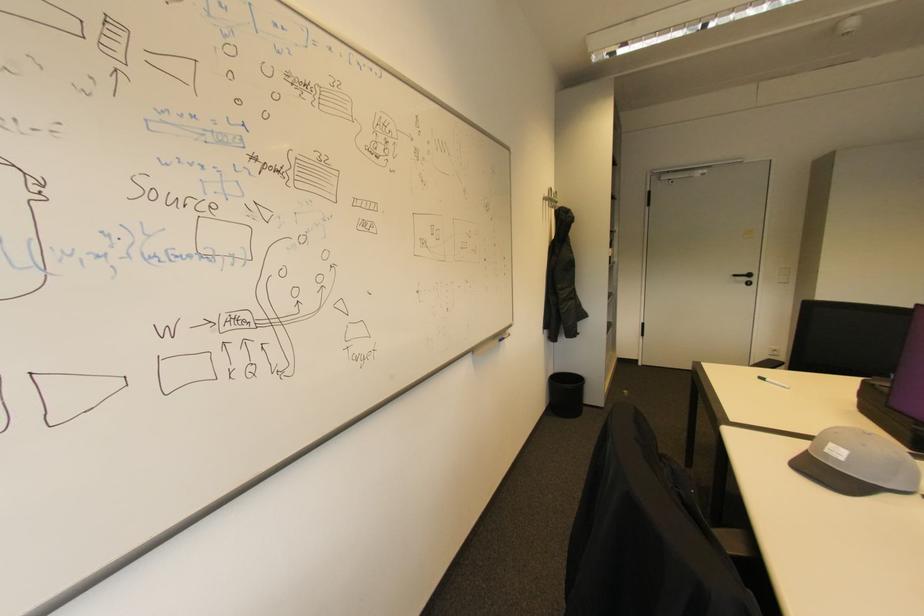
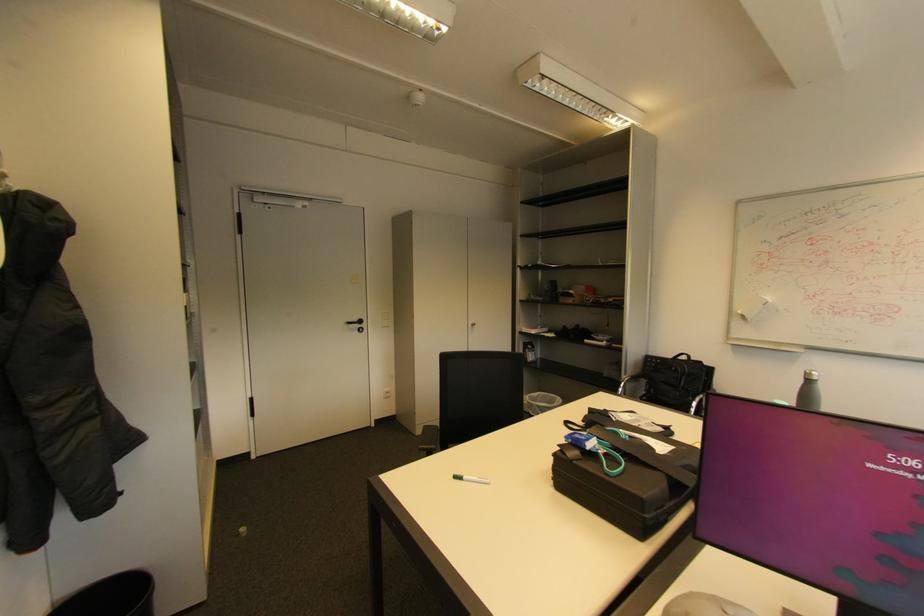
Where in the second image is the point corresponding to (768,379) from the first image?

(460, 477)